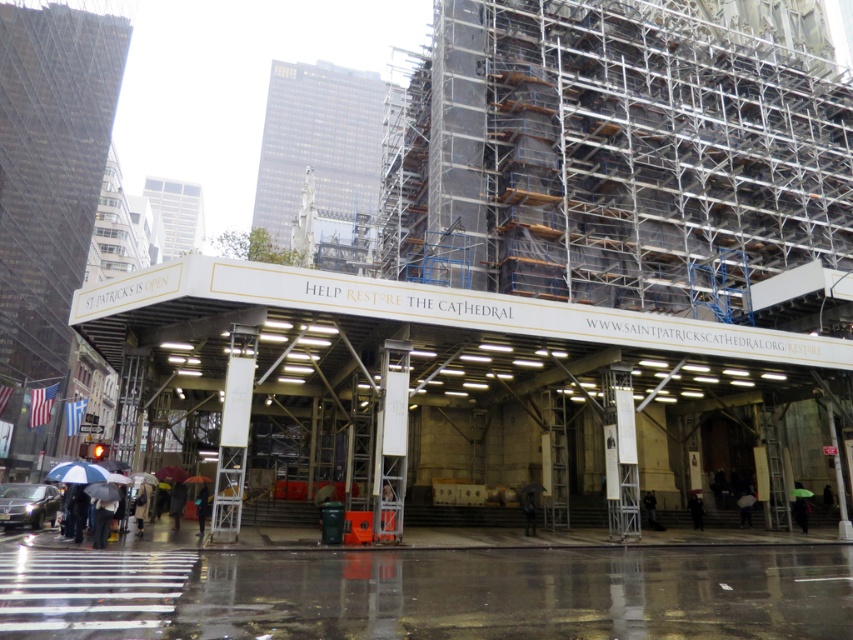
You are a delivery driver who needs to park your shiny black sedan at lower left near the cathedral. The parking spot is located at coordinates point (28, 506). Is your car already parked there?

Yes, the point (28, 506) indicates that the shiny black sedan at lower left is already parked there.

In the scene shown: You are standing in front of the cathedral and want to take a photo of the restoration sign. There are two points marked on the sign at coordinates point (x=51, y=506) and point (x=97, y=474). Which point is closer to you when you are facing the sign?

Point (x=51, y=506) is closer to you because it is further to the viewer than point (x=97, y=474).